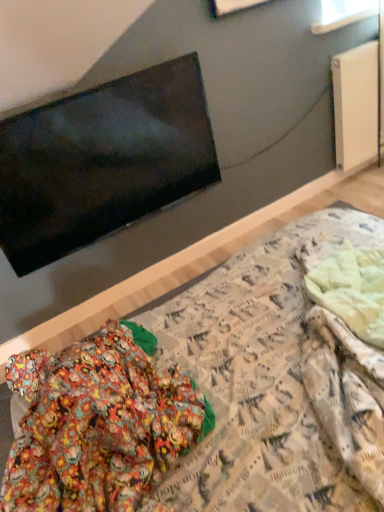
Question: Is flat matte black tv at upper left surrounding white matte radiator at upper right?

Choices:
 (A) yes
 (B) no

Answer: (B)

Question: Is flat matte black tv at upper left completely or partially outside of white matte radiator at upper right?

Choices:
 (A) no
 (B) yes

Answer: (B)

Question: Is flat matte black tv at upper left in front of white matte radiator at upper right?

Choices:
 (A) no
 (B) yes

Answer: (B)

Question: From the image's perspective, is flat matte black tv at upper left located beneath white matte radiator at upper right?

Choices:
 (A) yes
 (B) no

Answer: (A)

Question: Does flat matte black tv at upper left touch white matte radiator at upper right?

Choices:
 (A) yes
 (B) no

Answer: (B)

Question: From the image's perspective, relative to patterned fabric bed at center, is white matte radiator at upper right above or below?

Choices:
 (A) below
 (B) above

Answer: (B)

Question: Looking at the image, does white matte radiator at upper right seem bigger or smaller compared to patterned fabric bed at center?

Choices:
 (A) small
 (B) big

Answer: (A)

Question: Considering the relative positions of white matte radiator at upper right and patterned fabric bed at center in the image provided, is white matte radiator at upper right to the left or to the right of patterned fabric bed at center?

Choices:
 (A) right
 (B) left

Answer: (A)

Question: Considering the positions of white matte radiator at upper right and patterned fabric bed at center in the image, is white matte radiator at upper right wider or thinner than patterned fabric bed at center?

Choices:
 (A) wide
 (B) thin

Answer: (B)

Question: Is patterned fabric bed at center inside the boundaries of transparent glass window at upper right, or outside?

Choices:
 (A) outside
 (B) inside

Answer: (A)

Question: In the image, is patterned fabric bed at center on the left side or the right side of transparent glass window at upper right?

Choices:
 (A) left
 (B) right

Answer: (A)

Question: Is point (377, 388) closer or farther from the camera than point (372, 3)?

Choices:
 (A) farther
 (B) closer

Answer: (B)

Question: Is patterned fabric bed at center bigger or smaller than transparent glass window at upper right?

Choices:
 (A) small
 (B) big

Answer: (B)

Question: Considering the positions of patterned fabric bed at center and flat matte black tv at upper left in the image, is patterned fabric bed at center wider or thinner than flat matte black tv at upper left?

Choices:
 (A) thin
 (B) wide

Answer: (B)

Question: Looking at the image, does patterned fabric bed at center seem bigger or smaller compared to flat matte black tv at upper left?

Choices:
 (A) small
 (B) big

Answer: (B)